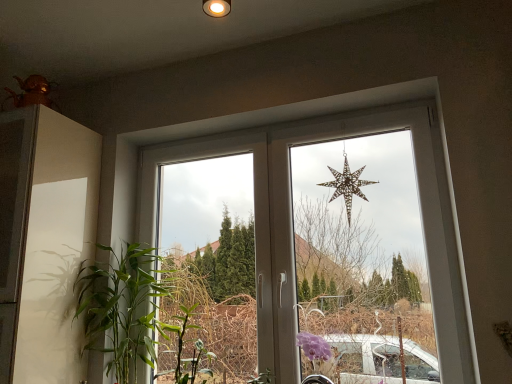
Question: Considering the relative positions of metallic gold star at upper center and metallic star at center in the image provided, is metallic gold star at upper center to the left or to the right of metallic star at center?

Choices:
 (A) right
 (B) left

Answer: (A)

Question: Is point (352, 173) closer or farther from the camera than point (162, 160)?

Choices:
 (A) closer
 (B) farther

Answer: (A)

Question: Considering the real-world distances, which object is farthest from the metallic gold star at upper center?

Choices:
 (A) metallic star at center
 (B) green leafy plant at left

Answer: (B)

Question: Estimate the real-world distances between objects in this image. Which object is farther from the metallic star at center?

Choices:
 (A) green leafy plant at left
 (B) metallic gold star at upper center

Answer: (A)